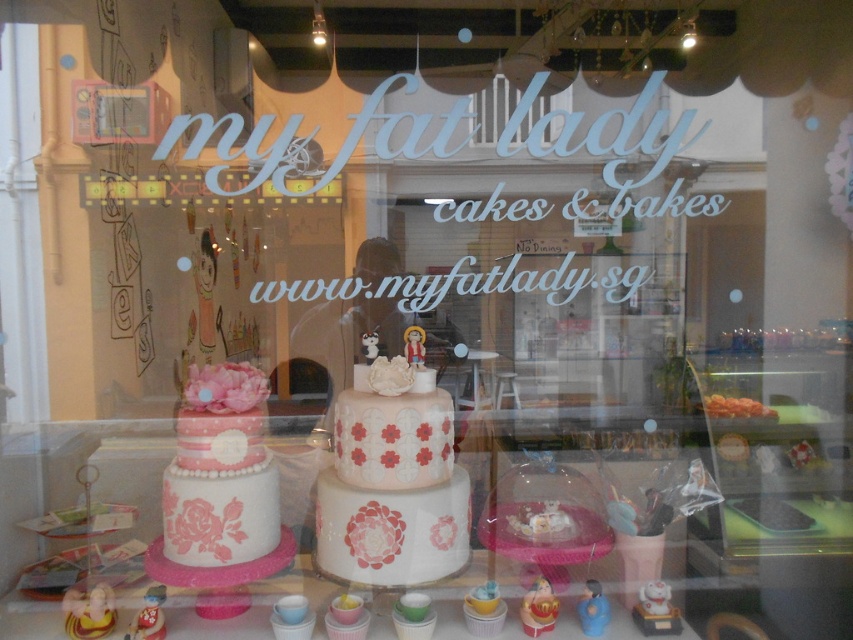
Is point (409, 376) positioned behind point (210, 400)?

Yes.

Is pink matte cake at center positioned behind matte pink fondant cake at center?

Yes, it is.

Is point (410, 401) farther from viewer compared to point (257, 424)?

No, (410, 401) is in front of (257, 424).

The image size is (853, 640). Find the location of `pink matte cake at center`. pink matte cake at center is located at coordinates (392, 481).